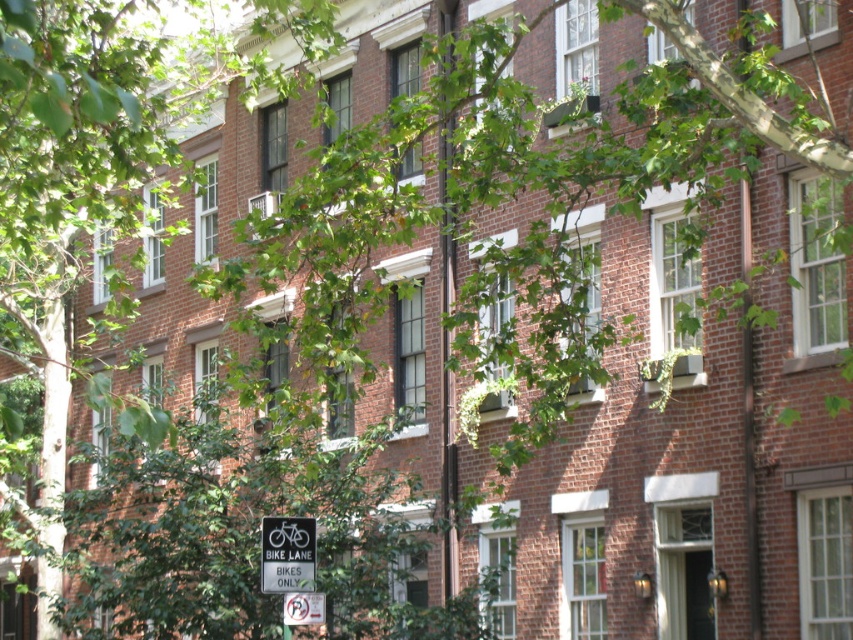
You are standing in front of a multi story brick building. You see a white plastic sign at lower left. Can you reach the sign without moving from your current position?

The white plastic sign at lower left is 15.84 meters away from you, so you cannot reach it without moving from your current position.

You are standing in front of the building and want to find the white plastic sign at lower left. Based on the coordinates provided, where should you look relative to the building?

The white plastic sign at lower left is located at the coordinates point (x=287, y=554), which corresponds to the lower left area of the image, near the bottom left corner.

You are a visitor approaching the building and notice two signs in the foreground. Which of the two signs, the white plastic sign at lower left or the white paper sign at lower center, is taller?

The white plastic sign at lower left is taller than the white paper sign at lower center.